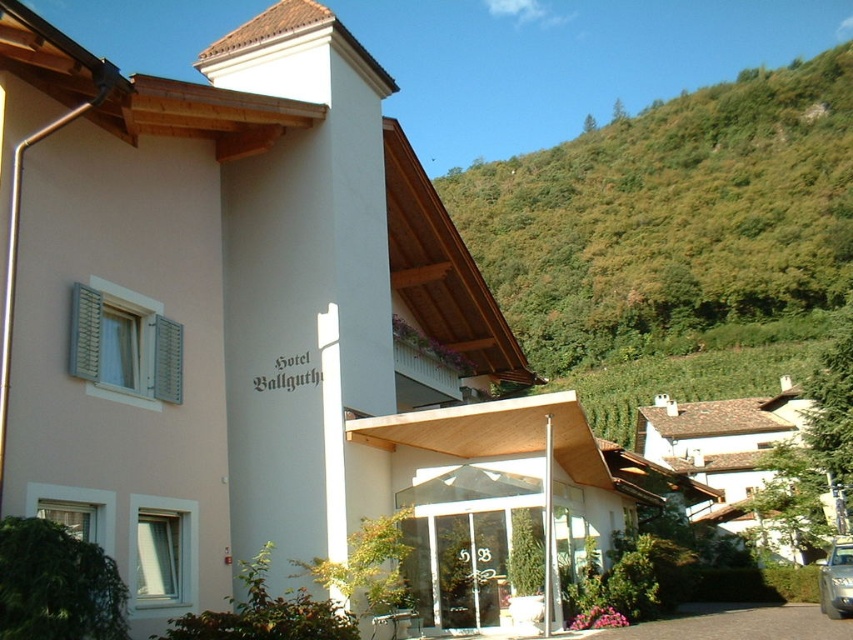
Question: Can you confirm if white stucco house at center is wider than silver metallic car at lower right?

Choices:
 (A) yes
 (B) no

Answer: (A)

Question: Is white stucco house at center bigger than silver metallic car at lower right?

Choices:
 (A) no
 (B) yes

Answer: (B)

Question: Which of the following is the farthest from the observer?

Choices:
 (A) (699, 460)
 (B) (846, 608)

Answer: (A)

Question: Is white stucco house at center smaller than silver metallic car at lower right?

Choices:
 (A) yes
 (B) no

Answer: (B)

Question: Which point is farther from the camera taking this photo?

Choices:
 (A) (831, 579)
 (B) (809, 410)

Answer: (B)